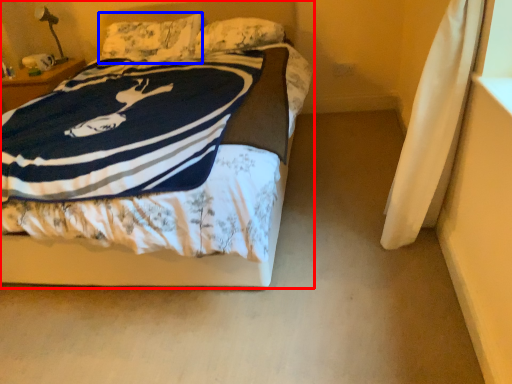
Question: Among these objects, which one is farthest to the camera, bed (highlighted by a red box) or pillow (highlighted by a blue box)?

Choices:
 (A) bed
 (B) pillow

Answer: (B)